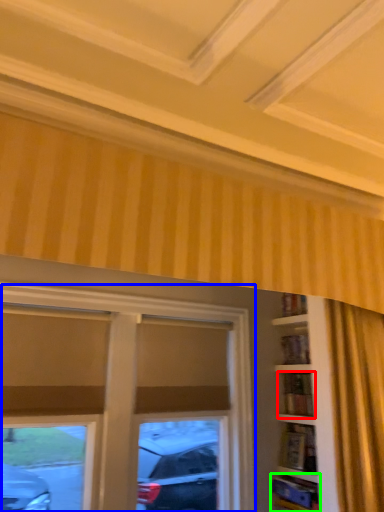
Question: Which object is positioned closest to shelf (highlighted by a red box)? Select from window (highlighted by a blue box) and shelf (highlighted by a green box).

Choices:
 (A) window
 (B) shelf

Answer: (B)